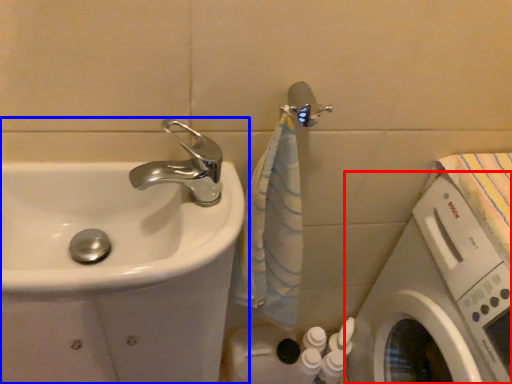
Question: Which point is further to the camera, washing machine (highlighted by a red box) or sink (highlighted by a blue box)?

Choices:
 (A) washing machine
 (B) sink

Answer: (B)